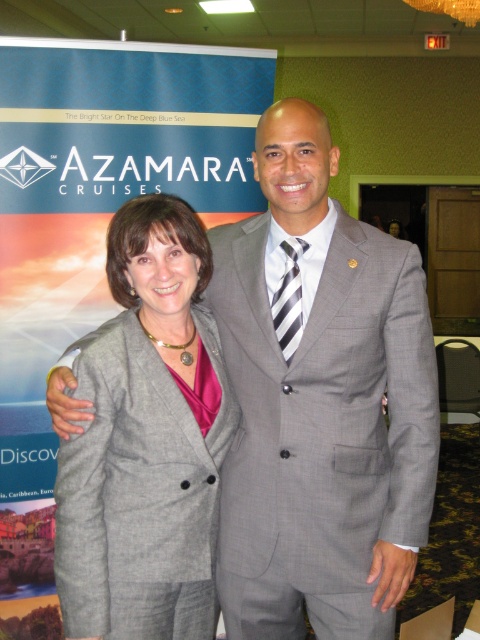
Question: From the image, what is the correct spatial relationship of gray textured suit at center in relation to gray wool suit at center?

Choices:
 (A) right
 (B) left

Answer: (A)

Question: Is gray textured suit at center wider than gray wool suit at center?

Choices:
 (A) yes
 (B) no

Answer: (A)

Question: Does gray textured suit at center lie in front of gray wool suit at center?

Choices:
 (A) no
 (B) yes

Answer: (A)

Question: Among these objects, which one is nearest to the camera?

Choices:
 (A) gray wool suit at center
 (B) gray textured suit at center

Answer: (A)

Question: Which object is closer to the camera taking this photo?

Choices:
 (A) gray wool suit at center
 (B) gray textured suit at center

Answer: (A)